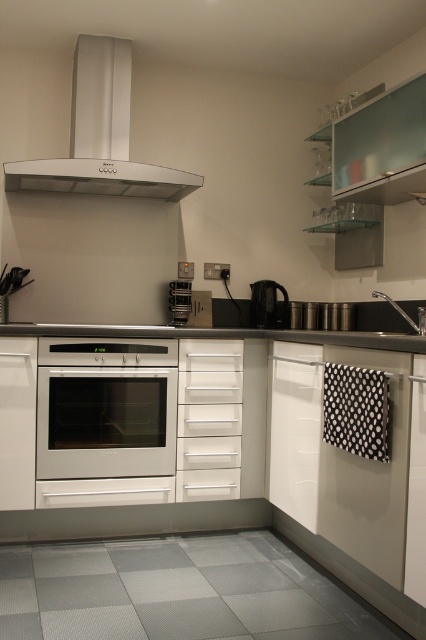
Question: Which point appears closest to the camera in this image?

Choices:
 (A) (160, 173)
 (B) (265, 298)

Answer: (A)

Question: From the image, what is the correct spatial relationship of white metallic exhaust hood at upper center in relation to white matte drawer at center?

Choices:
 (A) above
 (B) below

Answer: (A)

Question: Considering the relative positions of white glossy oven at center and white metallic exhaust hood at upper center in the image provided, where is white glossy oven at center located with respect to white metallic exhaust hood at upper center?

Choices:
 (A) left
 (B) right

Answer: (B)

Question: Which point appears closest to the camera in this image?

Choices:
 (A) (60, 380)
 (B) (298, 340)
 (C) (241, 412)
 (D) (97, 104)

Answer: (B)

Question: Among these objects, which one is nearest to the camera?

Choices:
 (A) black plastic kettle at center
 (B) white matte drawer at center

Answer: (B)

Question: Can you confirm if white metallic exhaust hood at upper center is thinner than white matte drawer at center?

Choices:
 (A) no
 (B) yes

Answer: (A)